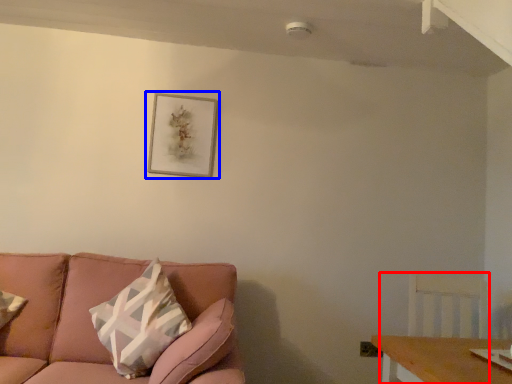
Question: Among these objects, which one is farthest to the camera, swivel chair (highlighted by a red box) or picture frame (highlighted by a blue box)?

Choices:
 (A) swivel chair
 (B) picture frame

Answer: (B)